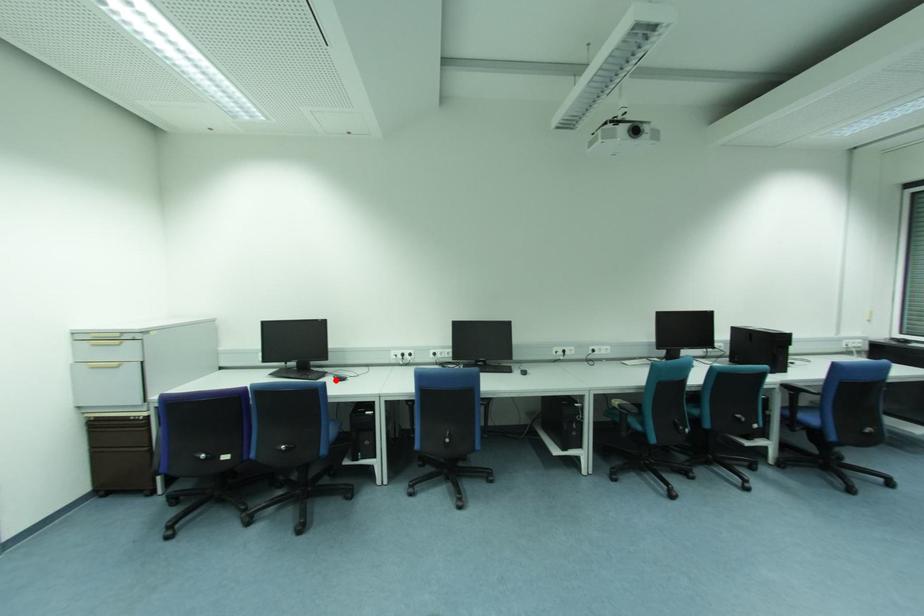
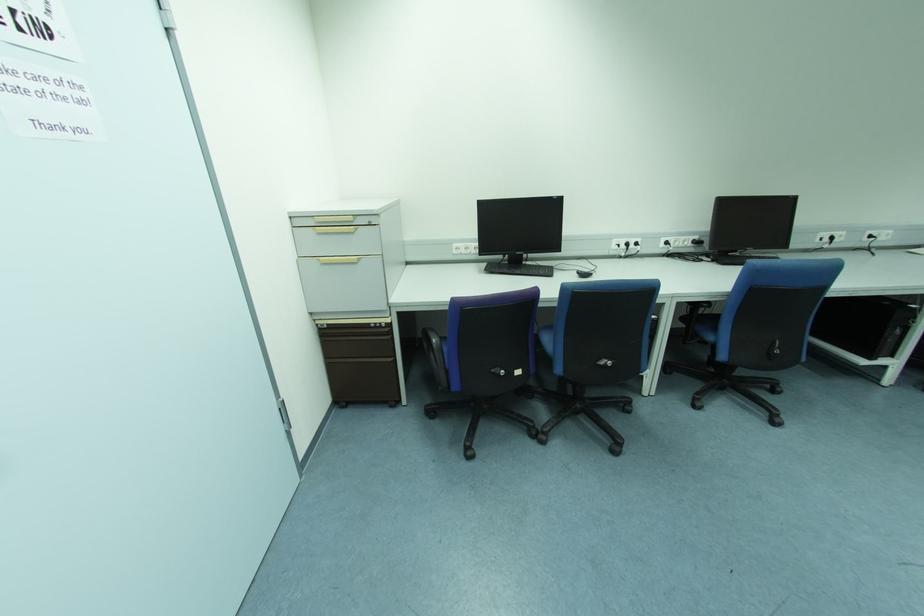
Question: A red point is marked in image1. In image2, is the corresponding 3D point closer to the camera or farther? Reply with the corresponding letter.

Choices:
 (A) The corresponding 3D point is closer.
 (B) The corresponding 3D point is farther.

Answer: (B)